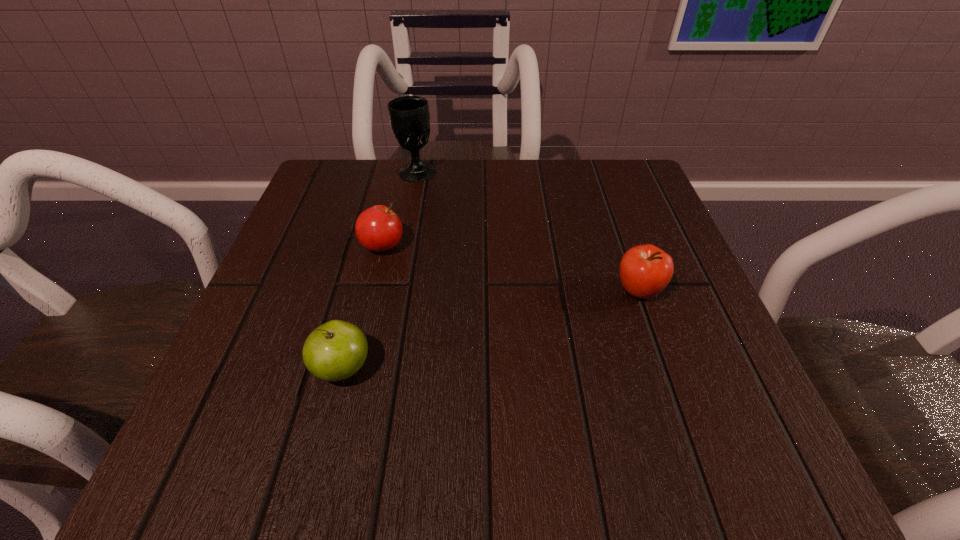
At what (x,y) coordinates should I click in order to perform the action: click on the tallest object. Please return your answer as a coordinate pair (x, y). This screenshot has height=540, width=960. Looking at the image, I should click on (409, 116).

Identify the location of the farthest object. (409, 116).

Where is `the second nearest apple`? The height and width of the screenshot is (540, 960). the second nearest apple is located at coordinates (645, 270).

The height and width of the screenshot is (540, 960). What are the coordinates of `the rightmost object` in the screenshot? It's located at (645, 270).

This screenshot has width=960, height=540. Identify the location of the nearest apple. (334, 351).

You are a GUI agent. You are given a task and a screenshot of the screen. Output one action in this format:
    pyautogui.click(x=<x>, y=<y>)
    Task: Click on the shortest object
    The image size is (960, 540).
    Given the screenshot: What is the action you would take?
    pyautogui.click(x=378, y=228)

Where is `the third nearest object`? The image size is (960, 540). the third nearest object is located at coordinates (378, 228).

You are a GUI agent. You are given a task and a screenshot of the screen. Output one action in this format:
    pyautogui.click(x=<x>, y=<y>)
    Task: Click on the free spot located on the front of the farthest object
    
    Given the screenshot: What is the action you would take?
    pyautogui.click(x=413, y=194)

Where is `vacant region located on the back of the second nearest object`? vacant region located on the back of the second nearest object is located at coordinates (601, 185).

I want to click on blank space located on the back of the nearest apple, so click(368, 271).